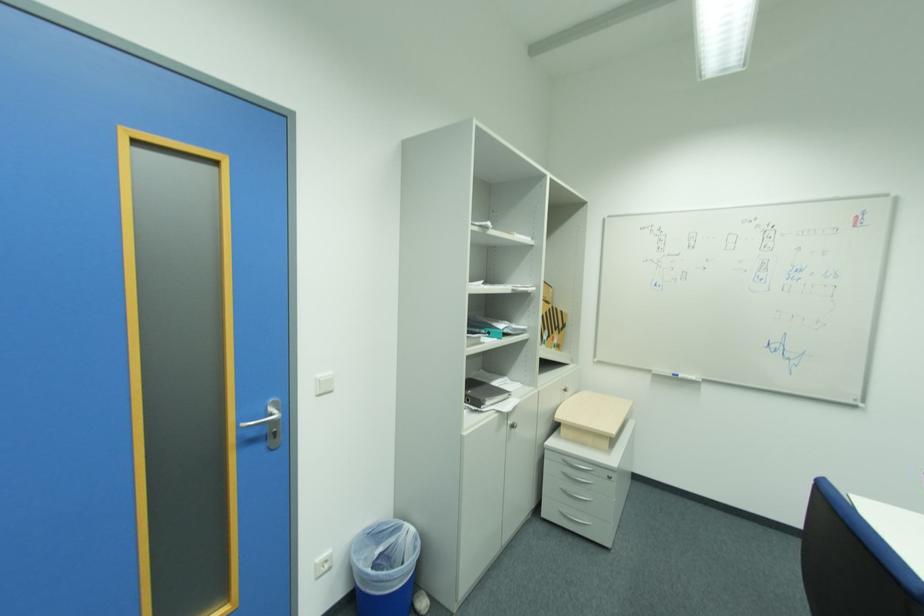
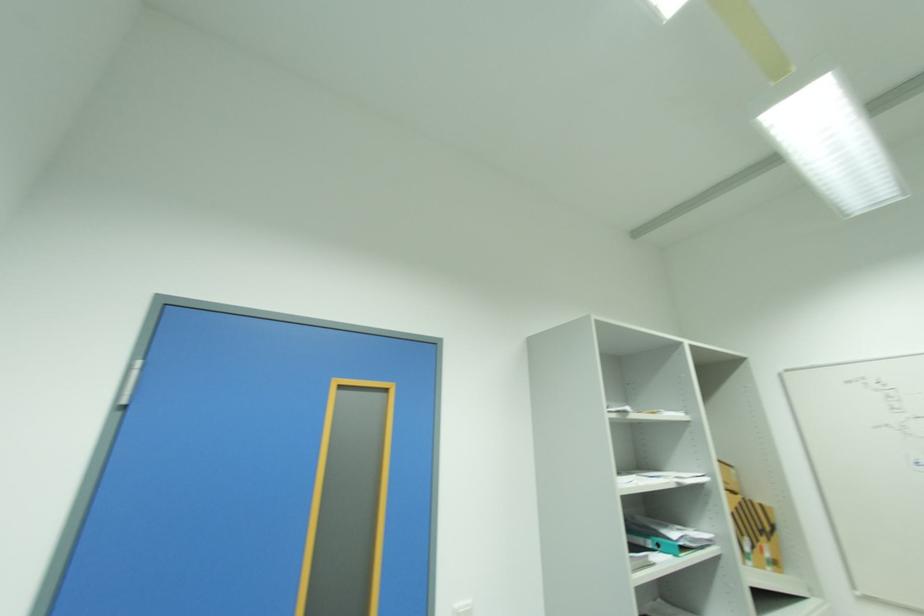
Locate, in the second image, the point that corresponds to [554,312] in the first image.

(746, 506)